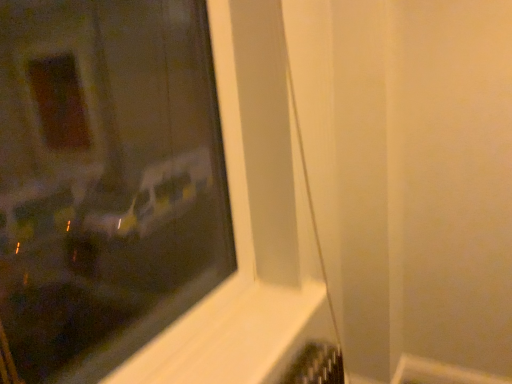
This screenshot has height=384, width=512. What do you see at coordinates (105, 181) in the screenshot?
I see `transparent glass window at upper left` at bounding box center [105, 181].

Find the location of a particular element. transparent glass window at upper left is located at coordinates (105, 181).

You are a GUI agent. You are given a task and a screenshot of the screen. Output one action in this format:
    pyautogui.click(x=<x>, y=<y>)
    Task: Click on the transparent glass window at upper left
    
    Given the screenshot: What is the action you would take?
    pyautogui.click(x=105, y=181)